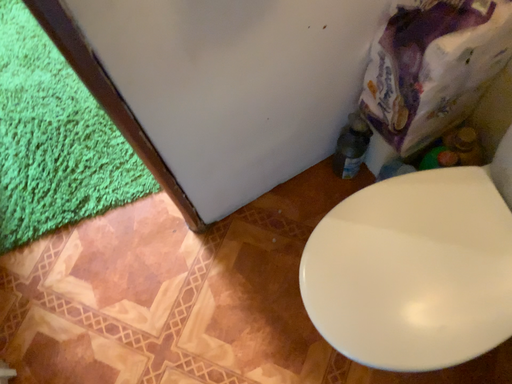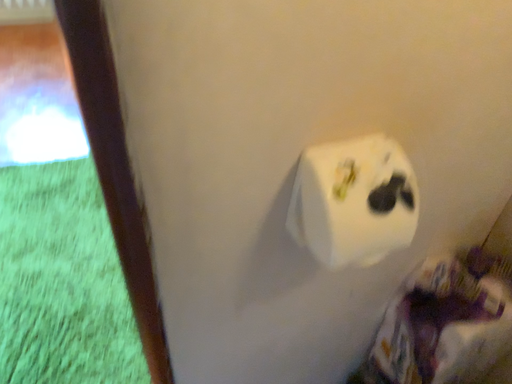
Question: How did the camera likely rotate when shooting the video?

Choices:
 (A) rotated upward
 (B) rotated downward

Answer: (A)